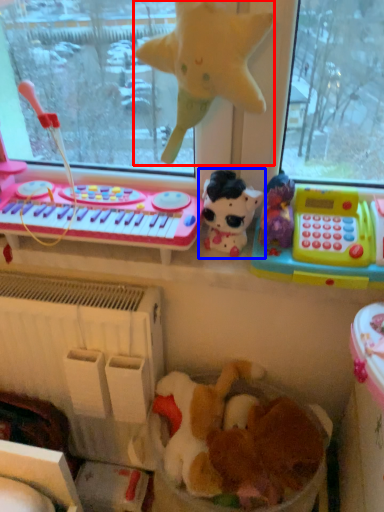
Question: Which point is further to the camera, toy (highlighted by a red box) or toy (highlighted by a blue box)?

Choices:
 (A) toy
 (B) toy

Answer: (B)